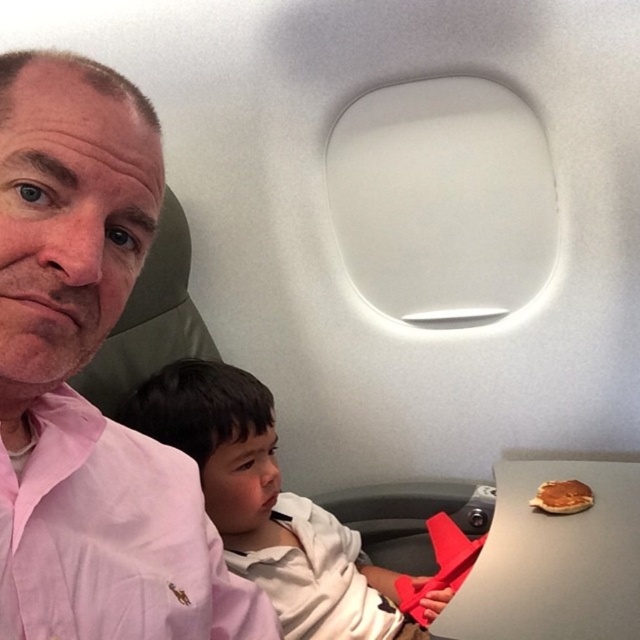
Question: Which object is positioned closest to the pink cotton shirt at left?

Choices:
 (A) pink fabric shirt at left
 (B) golden brown pancake at lower right
 (C) white cotton shirt at center

Answer: (A)

Question: Observing the image, what is the correct spatial positioning of pink cotton shirt at left in reference to golden brown pancake at lower right?

Choices:
 (A) below
 (B) above

Answer: (B)

Question: Is pink cotton shirt at left bigger than golden brown pancake at lower right?

Choices:
 (A) no
 (B) yes

Answer: (B)

Question: Can you confirm if pink cotton shirt at left is positioned below golden brown pancake at lower right?

Choices:
 (A) no
 (B) yes

Answer: (A)

Question: Among these objects, which one is nearest to the camera?

Choices:
 (A) pink fabric shirt at left
 (B) pink cotton shirt at left
 (C) white cotton shirt at center
 (D) golden brown pancake at lower right

Answer: (A)

Question: Which point appears farthest from the camera in this image?

Choices:
 (A) (33, 538)
 (B) (557, 497)
 (C) (289, 621)

Answer: (B)